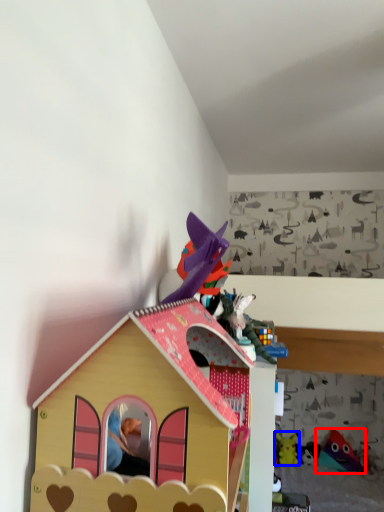
Question: Among these objects, which one is nearest to the camera, toy (highlighted by a red box) or toy (highlighted by a blue box)?

Choices:
 (A) toy
 (B) toy

Answer: (A)